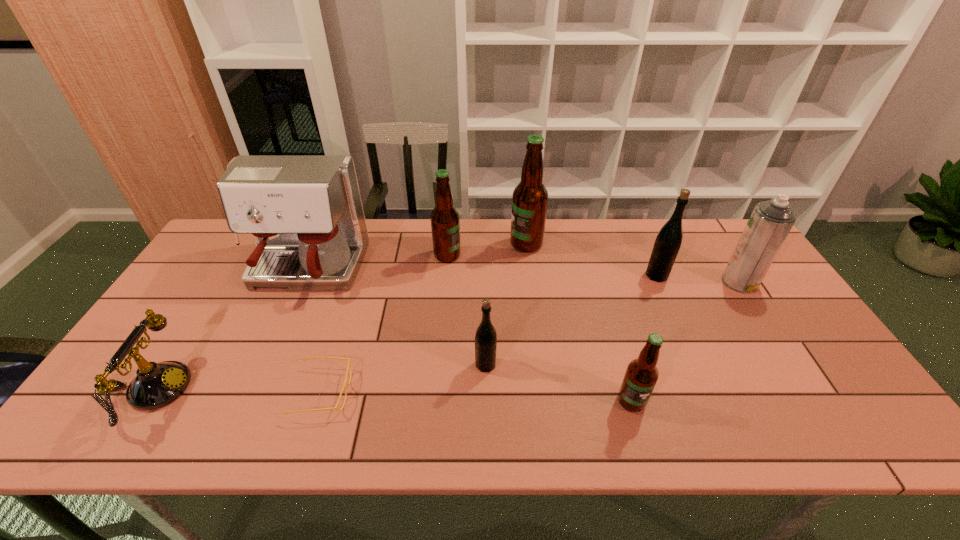
Where is `blank area in the image that satisfies the following two spatial constraints: 1. on the label of the fourth object from left to right; 2. on the right side of the third nearest beer bottle`? The image size is (960, 540). blank area in the image that satisfies the following two spatial constraints: 1. on the label of the fourth object from left to right; 2. on the right side of the third nearest beer bottle is located at coordinates (445, 275).